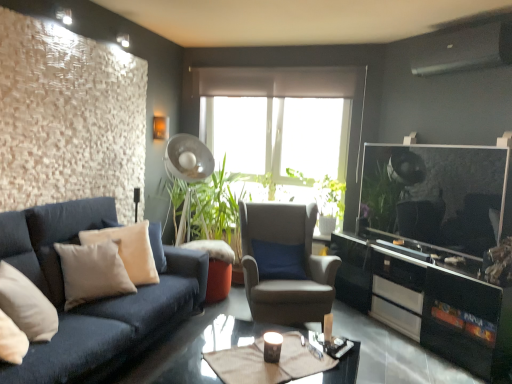
Question: Is suede-like gray armchair at center to the left of beige fabric pillow at left, positioned as the second pillow in front-to-back order, from the viewer's perspective?

Choices:
 (A) no
 (B) yes

Answer: (A)

Question: Can you confirm if suede-like gray armchair at center is thinner than beige fabric pillow at left, the first pillow viewed from the back?

Choices:
 (A) no
 (B) yes

Answer: (A)

Question: Does suede-like gray armchair at center have a greater height compared to beige fabric pillow at left, positioned as the second pillow in front-to-back order?

Choices:
 (A) yes
 (B) no

Answer: (A)

Question: Does suede-like gray armchair at center lie behind beige fabric pillow at left, the first pillow viewed from the back?

Choices:
 (A) no
 (B) yes

Answer: (B)

Question: From a real-world perspective, is suede-like gray armchair at center under beige fabric pillow at left, the first pillow viewed from the back?

Choices:
 (A) no
 (B) yes

Answer: (B)

Question: Considering the relative positions of suede-like gray armchair at center and beige fabric pillow at left, the first pillow viewed from the back, in the image provided, is suede-like gray armchair at center in front of beige fabric pillow at left, the first pillow viewed from the back,?

Choices:
 (A) no
 (B) yes

Answer: (A)

Question: Would you say beige fabric pillow at left, positioned as the second pillow in front-to-back order, is outside metallic silver fan at center?

Choices:
 (A) yes
 (B) no

Answer: (A)

Question: Considering the relative positions of beige fabric pillow at left, positioned as the second pillow in front-to-back order, and metallic silver fan at center in the image provided, is beige fabric pillow at left, positioned as the second pillow in front-to-back order, to the left of metallic silver fan at center from the viewer's perspective?

Choices:
 (A) no
 (B) yes

Answer: (B)

Question: Is the position of beige fabric pillow at left, positioned as the second pillow in front-to-back order, more distant than that of metallic silver fan at center?

Choices:
 (A) yes
 (B) no

Answer: (B)

Question: Considering the relative sizes of beige fabric pillow at left, the first pillow viewed from the back, and metallic silver fan at center in the image provided, is beige fabric pillow at left, the first pillow viewed from the back, thinner than metallic silver fan at center?

Choices:
 (A) no
 (B) yes

Answer: (B)

Question: Is beige fabric pillow at left, positioned as the second pillow in front-to-back order, beside metallic silver fan at center?

Choices:
 (A) no
 (B) yes

Answer: (A)

Question: Is beige fabric pillow at left, positioned as the second pillow in front-to-back order, bigger than metallic silver fan at center?

Choices:
 (A) no
 (B) yes

Answer: (A)

Question: Are beige fabric pillow at left, positioned as the second pillow in front-to-back order, and shiny black glass coffee table at center located far from each other?

Choices:
 (A) no
 (B) yes

Answer: (A)